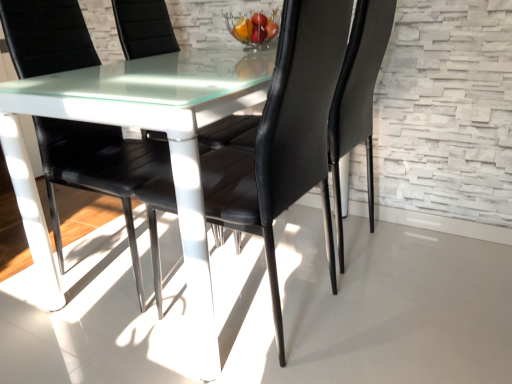
Locate an element on the screen. The image size is (512, 384). black leather chair at center, the first chair positioned from the left is located at coordinates (98, 169).

Measure the distance between point (153, 39) and camera.

5.86 feet.

In order to click on black leather chair at center, which ranks as the third chair in left-to-right order in this screenshot , I will do `click(284, 137)`.

The width and height of the screenshot is (512, 384). Identify the location of black leather chair at center, the first chair viewed from the right. (229, 132).

You are a GUI agent. You are given a task and a screenshot of the screen. Output one action in this format:
    pyautogui.click(x=<x>, y=<y>)
    Task: Click on the black leather chair at center, which is the 4th chair from right to left
    This screenshot has height=384, width=512.
    Given the screenshot: What is the action you would take?
    pyautogui.click(x=98, y=169)

Considering the relative positions of black leather chair at center, the first chair viewed from the right, and black leather chair at center, which ranks as the third chair in left-to-right order, in the image provided, is black leather chair at center, the first chair viewed from the right, to the right of black leather chair at center, which ranks as the third chair in left-to-right order, from the viewer's perspective?

Indeed, black leather chair at center, the first chair viewed from the right, is positioned on the right side of black leather chair at center, which ranks as the third chair in left-to-right order.

From the image's perspective, which chair is the 2nd one below the black leather chair at center, the first chair viewed from the right? Please provide its 2D coordinates.

[(284, 137)]

Is point (222, 122) closer to camera compared to point (170, 209)?

Yes, point (222, 122) is in front of point (170, 209).

Considering the relative sizes of black leather chair at center, the fourth chair in the left-to-right sequence, and black leather chair at center, arranged as the second chair when viewed from the right, in the image provided, is black leather chair at center, the fourth chair in the left-to-right sequence, taller than black leather chair at center, arranged as the second chair when viewed from the right,?

In fact, black leather chair at center, the fourth chair in the left-to-right sequence, may be shorter than black leather chair at center, arranged as the second chair when viewed from the right.

I want to click on chair that is the 1st one when counting forward from the black leather chair at center, which appears as the 3th chair when viewed from the right, so click(229, 132).

Who is smaller, black leather chair at center, which appears as the 3th chair when viewed from the right, or black leather chair at center, the fourth chair in the left-to-right sequence?

black leather chair at center, which appears as the 3th chair when viewed from the right.

Measure the distance between black leather chair at center, marked as the 2th chair in a left-to-right arrangement, and black leather chair at center, the fourth chair in the left-to-right sequence.

34.65 inches.

From a real-world perspective, is black leather chair at center, marked as the 2th chair in a left-to-right arrangement, below black leather chair at center, the fourth chair in the left-to-right sequence?

No, from a real-world perspective, black leather chair at center, marked as the 2th chair in a left-to-right arrangement, is not below black leather chair at center, the fourth chair in the left-to-right sequence.

Does black leather chair at center, the first chair viewed from the right, turn towards black leather chair at center, the first chair positioned from the left?

No, black leather chair at center, the first chair viewed from the right, is not facing towards black leather chair at center, the first chair positioned from the left.

Is point (370, 148) less distant than point (42, 126)?

No, (370, 148) is further to viewer.

Measure the distance from black leather chair at center, the first chair viewed from the right, to black leather chair at center, the first chair positioned from the left.

They are 33.38 inches apart.

At what (x,y) coordinates should I click in order to perform the action: click on the 2nd chair above the black leather chair at center, the fourth chair in the left-to-right sequence (from a real-world perspective). Please return your answer as a coordinate pair (x, y). Looking at the image, I should click on (98, 169).

Between black leather chair at center, which is the 4th chair from right to left, and black leather chair at center, which ranks as the third chair in left-to-right order, which one has less height?

Standing shorter between the two is black leather chair at center, which ranks as the third chair in left-to-right order.

Considering the positions of objects black leather chair at center, which is the 4th chair from right to left, and black leather chair at center, which ranks as the third chair in left-to-right order, in the image provided, who is more to the right, black leather chair at center, which is the 4th chair from right to left, or black leather chair at center, which ranks as the third chair in left-to-right order,?

black leather chair at center, which ranks as the third chair in left-to-right order.

Is black leather chair at center, which is the 4th chair from right to left, not within black leather chair at center, which ranks as the third chair in left-to-right order?

Yes, black leather chair at center, which is the 4th chair from right to left, is located beyond the bounds of black leather chair at center, which ranks as the third chair in left-to-right order.

Is black leather chair at center, which is the 4th chair from right to left, smaller than black leather chair at center, arranged as the second chair when viewed from the right?

Actually, black leather chair at center, which is the 4th chair from right to left, might be larger than black leather chair at center, arranged as the second chair when viewed from the right.

Does black leather chair at center, which appears as the 3th chair when viewed from the right, appear on the right side of black leather chair at center, which ranks as the third chair in left-to-right order?

In fact, black leather chair at center, which appears as the 3th chair when viewed from the right, is to the left of black leather chair at center, which ranks as the third chair in left-to-right order.

Considering the positions of points (134, 5) and (291, 152), is point (134, 5) closer to camera compared to point (291, 152)?

That is False.

Is black leather chair at center, arranged as the second chair when viewed from the right, located within black leather chair at center, marked as the 2th chair in a left-to-right arrangement?

No, black leather chair at center, arranged as the second chair when viewed from the right, is not surrounded by black leather chair at center, marked as the 2th chair in a left-to-right arrangement.

At what (x,y) coordinates should I click in order to perform the action: click on the 3rd chair in front of the black leather chair at center, which appears as the 3th chair when viewed from the right, counting from the anchor's position. Please return your answer as a coordinate pair (x, y). The height and width of the screenshot is (384, 512). Looking at the image, I should click on (284, 137).

Would you say black leather chair at center, marked as the 2th chair in a left-to-right arrangement, is part of black leather chair at center, arranged as the second chair when viewed from the right,'s contents?

Actually, black leather chair at center, marked as the 2th chair in a left-to-right arrangement, is outside black leather chair at center, arranged as the second chair when viewed from the right.

Is black leather chair at center, arranged as the second chair when viewed from the right, oriented away from black leather chair at center, marked as the 2th chair in a left-to-right arrangement?

No.

Is black leather chair at center, arranged as the second chair when viewed from the right, to the left of black leather chair at center, which appears as the 3th chair when viewed from the right, from the viewer's perspective?

No, black leather chair at center, arranged as the second chair when viewed from the right, is not to the left of black leather chair at center, which appears as the 3th chair when viewed from the right.

From a real-world perspective, between black leather chair at center, which ranks as the third chair in left-to-right order, and black leather chair at center, the first chair positioned from the left, who is vertically higher?

black leather chair at center, the first chair positioned from the left.

Considering the positions of objects black leather chair at center, arranged as the second chair when viewed from the right, and black leather chair at center, the first chair positioned from the left, in the image provided, who is behind, black leather chair at center, arranged as the second chair when viewed from the right, or black leather chair at center, the first chair positioned from the left,?

black leather chair at center, the first chair positioned from the left, is more distant.

From the picture: Which of these two, black leather chair at center, arranged as the second chair when viewed from the right, or black leather chair at center, which is the 4th chair from right to left, is smaller?

Smaller between the two is black leather chair at center, arranged as the second chair when viewed from the right.

Which chair is the 1st one when counting from the left side of the black leather chair at center, the first chair viewed from the right? Please provide its 2D coordinates.

[(284, 137)]

Where is `chair behind the black leather chair at center, the fourth chair in the left-to-right sequence`? The width and height of the screenshot is (512, 384). chair behind the black leather chair at center, the fourth chair in the left-to-right sequence is located at coordinates (144, 28).

Estimate the real-world distances between objects in this image. Which object is closer to black leather chair at center, which is the 4th chair from right to left, black leather chair at center, which ranks as the third chair in left-to-right order, or black leather chair at center, the first chair viewed from the right?

black leather chair at center, which ranks as the third chair in left-to-right order, is closer to black leather chair at center, which is the 4th chair from right to left.

From the image, which object appears to be nearer to black leather chair at center, which ranks as the third chair in left-to-right order, black leather chair at center, which is the 4th chair from right to left, or black leather chair at center, which appears as the 3th chair when viewed from the right?

black leather chair at center, which is the 4th chair from right to left, lies closer to black leather chair at center, which ranks as the third chair in left-to-right order, than the other object.

Looking at the image, which one is located closer to black leather chair at center, the first chair viewed from the right, black leather chair at center, arranged as the second chair when viewed from the right, or black leather chair at center, which is the 4th chair from right to left?

Based on the image, black leather chair at center, arranged as the second chair when viewed from the right, appears to be nearer to black leather chair at center, the first chair viewed from the right.

From the image, which object appears to be nearer to black leather chair at center, which appears as the 3th chair when viewed from the right, black leather chair at center, arranged as the second chair when viewed from the right, or black leather chair at center, the first chair viewed from the right?

black leather chair at center, the first chair viewed from the right.

Which object lies nearer to the anchor point black leather chair at center, marked as the 2th chair in a left-to-right arrangement, black leather chair at center, the first chair positioned from the left, or black leather chair at center, which ranks as the third chair in left-to-right order?

The object closer to black leather chair at center, marked as the 2th chair in a left-to-right arrangement, is black leather chair at center, the first chair positioned from the left.

Based on their spatial positions, is black leather chair at center, the fourth chair in the left-to-right sequence, or black leather chair at center, which appears as the 3th chair when viewed from the right, closer to black leather chair at center, arranged as the second chair when viewed from the right?

black leather chair at center, the fourth chair in the left-to-right sequence, lies closer to black leather chair at center, arranged as the second chair when viewed from the right, than the other object.

From the image, which object appears to be nearer to black leather chair at center, the fourth chair in the left-to-right sequence, black leather chair at center, arranged as the second chair when viewed from the right, or black leather chair at center, which appears as the 3th chair when viewed from the right?

black leather chair at center, arranged as the second chair when viewed from the right, is positioned closer to the anchor black leather chair at center, the fourth chair in the left-to-right sequence.

Based on their spatial positions, is black leather chair at center, marked as the 2th chair in a left-to-right arrangement, or black leather chair at center, which ranks as the third chair in left-to-right order, further from black leather chair at center, the first chair viewed from the right?

black leather chair at center, marked as the 2th chair in a left-to-right arrangement, is further to black leather chair at center, the first chair viewed from the right.